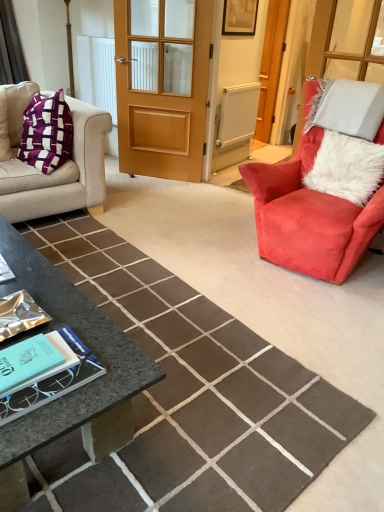
Question: From a real-world perspective, is white textured radiator at center physically located above or below teal matte book at lower left?

Choices:
 (A) above
 (B) below

Answer: (A)

Question: In the image, is white textured radiator at center on the left side or the right side of teal matte book at lower left?

Choices:
 (A) left
 (B) right

Answer: (B)

Question: Considering the real-world distances, which object is farthest from the velvet beige couch at left?

Choices:
 (A) wooden picture frame at upper center
 (B) wooden screen door at center
 (C) white fluffy pillow at right
 (D) wooden door at center
 (E) teal matte book at lower left

Answer: (B)

Question: Which object is positioned closest to the wooden screen door at center?

Choices:
 (A) velvet red armchair at right
 (B) wooden picture frame at upper center
 (C) white textured radiator at center
 (D) wooden door at center
 (E) granite coffee table at lower left

Answer: (B)